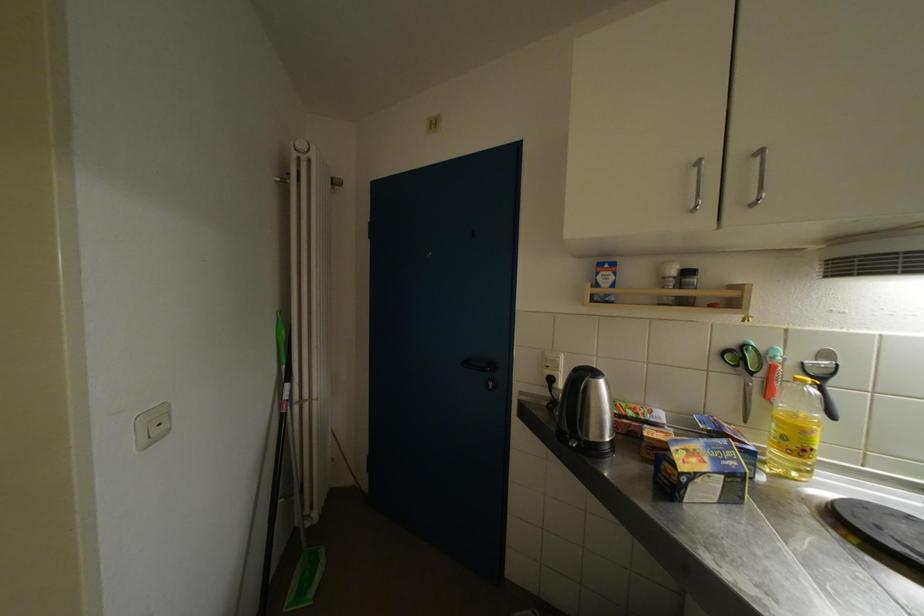
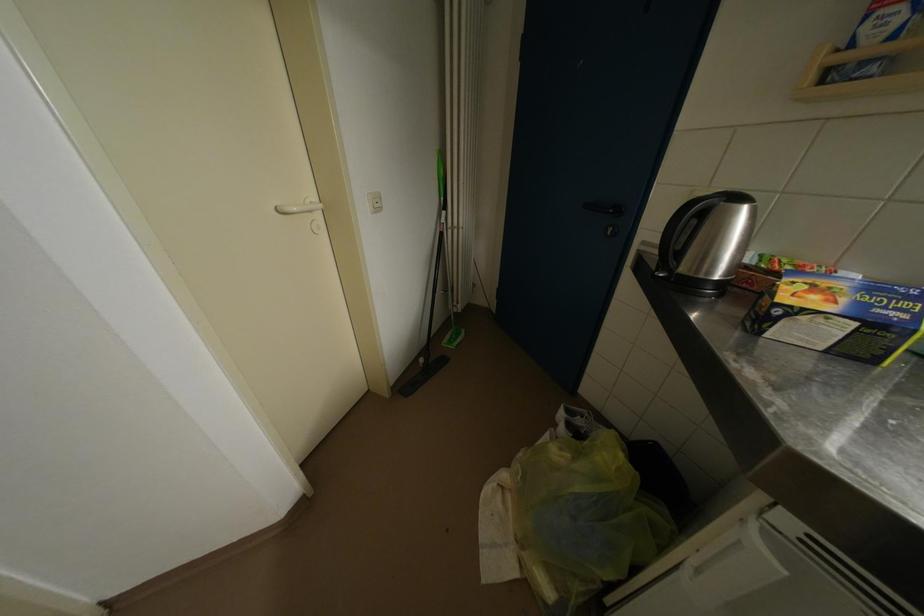
The point at [609,385] is marked in the first image. Where is the corresponding point in the second image?

(752, 213)